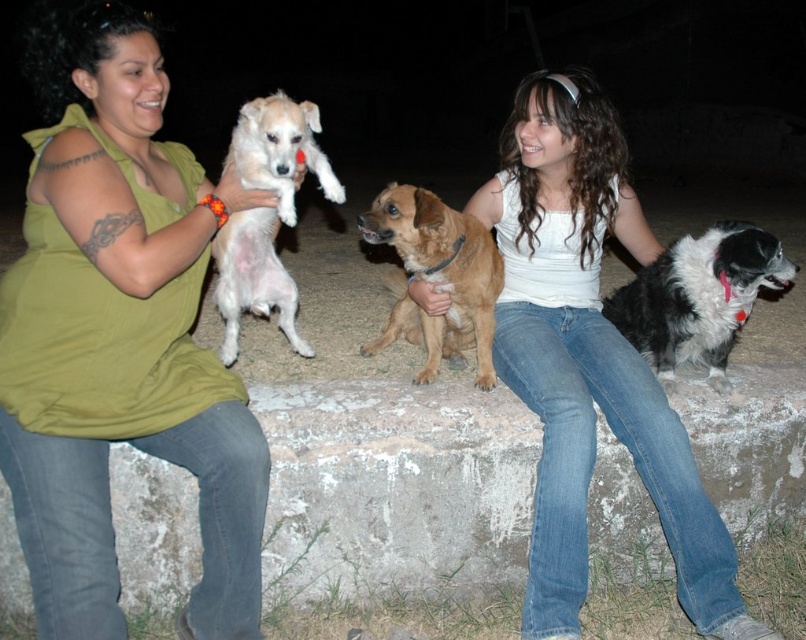
Question: Which object appears farthest from the camera in this image?

Choices:
 (A) smooth concrete stone at center
 (B) green matte shirt at upper left
 (C) white fluffy dog at upper left
 (D) black and white fluffy dog at lower right

Answer: (D)

Question: Is green matte shirt at upper left smaller than white cotton tank top at center?

Choices:
 (A) no
 (B) yes

Answer: (B)

Question: Can you confirm if green matte shirt at upper left is bigger than brown furry dog at center?

Choices:
 (A) yes
 (B) no

Answer: (A)

Question: Which of the following is the farthest from the observer?

Choices:
 (A) white cotton tank top at center
 (B) white fluffy dog at upper left

Answer: (A)

Question: Which of the following is the farthest from the observer?

Choices:
 (A) brown furry dog at center
 (B) black and white fluffy dog at lower right

Answer: (B)

Question: Is green matte shirt at upper left to the right of white fluffy dog at upper left from the viewer's perspective?

Choices:
 (A) no
 (B) yes

Answer: (A)